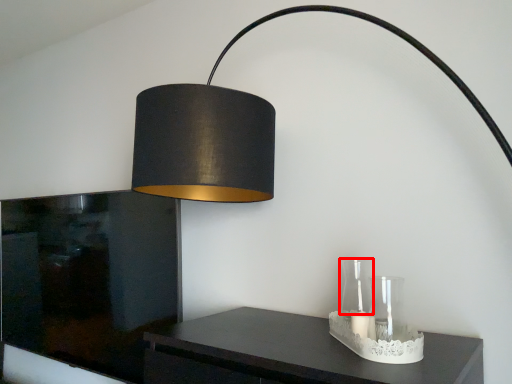
Question: From the image's perspective, what is the correct spatial positioning of glass vase (annotated by the red box) in reference to glass vase?

Choices:
 (A) below
 (B) above

Answer: (A)